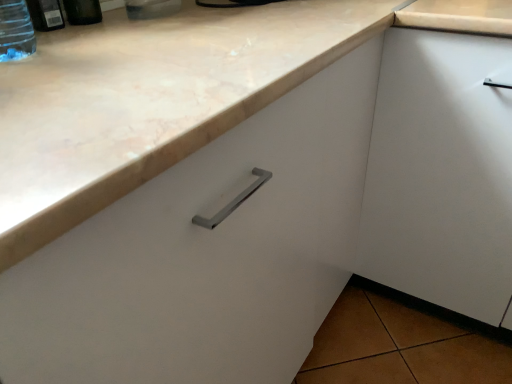
Question: In the image, is transparent plastic bottle at upper left, the first bottle in the left-to-right sequence, positioned in front of or behind transparent plastic bottle at upper left, marked as the 2th bottle in a left-to-right arrangement?

Choices:
 (A) behind
 (B) front

Answer: (B)

Question: Is point (4, 31) positioned closer to the camera than point (54, 18)?

Choices:
 (A) closer
 (B) farther

Answer: (A)

Question: Estimate the real-world distances between objects in this image. Which object is closer to the transparent plastic bottle at upper left, the first bottle in the left-to-right sequence?

Choices:
 (A) marble countertop at upper left
 (B) transparent plastic bottle at upper left, placed as the second bottle when sorted from right to left
 (C) matte plastic bottle at upper left, the first bottle in the right-to-left sequence

Answer: (B)

Question: Which object is positioned closest to the matte plastic bottle at upper left, the first bottle in the right-to-left sequence?

Choices:
 (A) transparent plastic bottle at upper left, placed as the second bottle when sorted from right to left
 (B) transparent plastic bottle at upper left, the first bottle in the left-to-right sequence
 (C) marble countertop at upper left

Answer: (A)